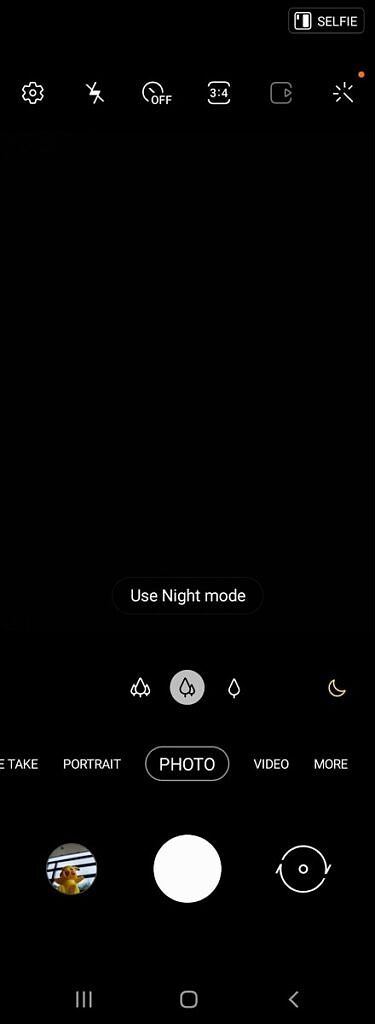
Locate an element on the screen. This screenshot has height=1024, width=375. yellow teddy is located at coordinates (65, 882).